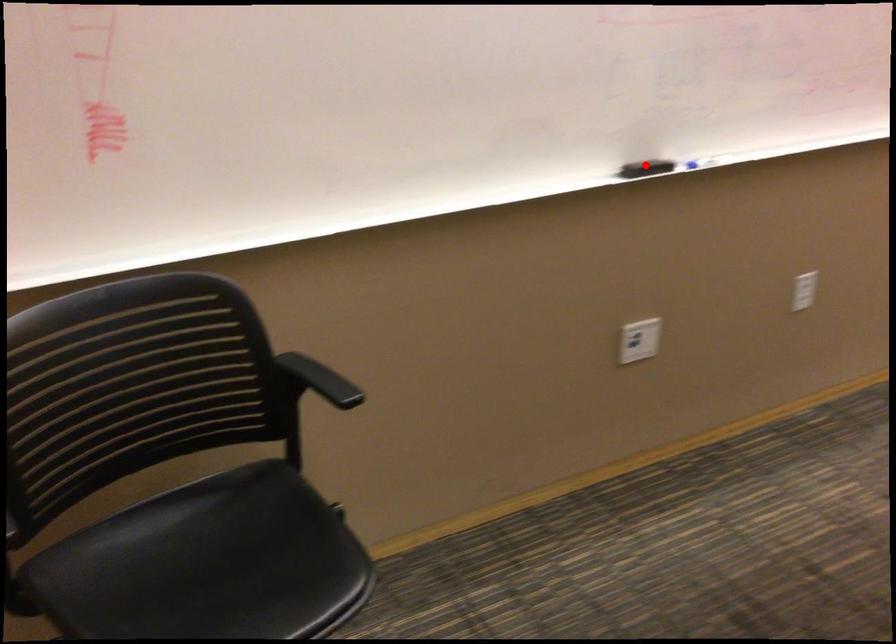
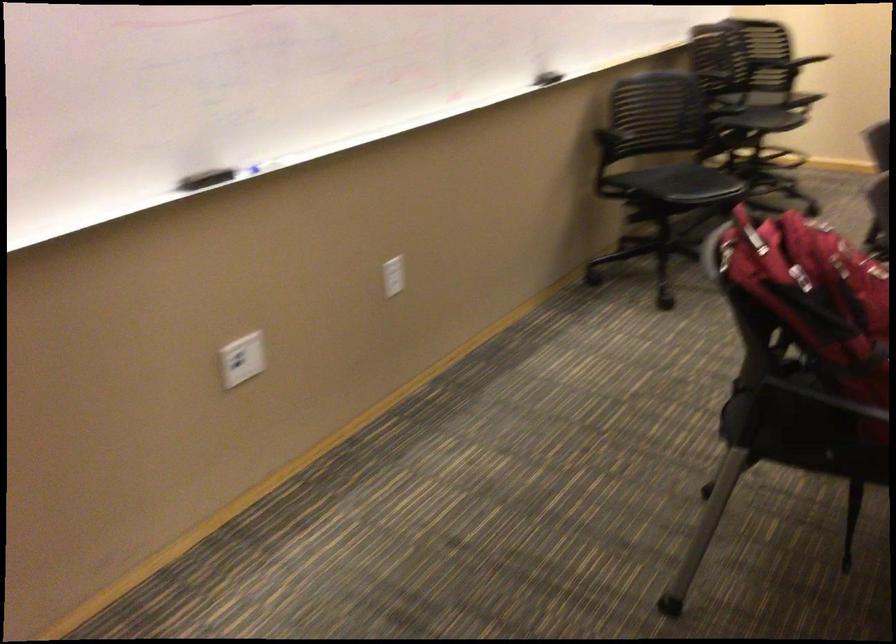
Find the pixel in the second image that matches the highlighted location in the first image.

(204, 178)